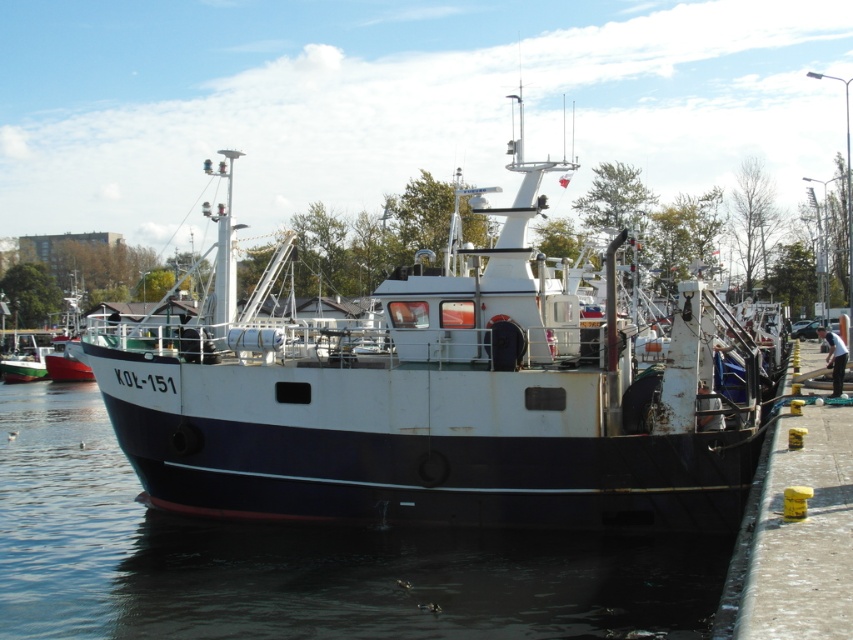
Question: Is white matte boat at center smaller than blue matte water at center?

Choices:
 (A) yes
 (B) no

Answer: (B)

Question: Which of the following is the farthest from the observer?

Choices:
 (A) (25, 333)
 (B) (483, 397)

Answer: (A)

Question: Can you confirm if blue matte water at center is smaller than white matte boat at left?

Choices:
 (A) no
 (B) yes

Answer: (A)

Question: Which point is farther to the camera?

Choices:
 (A) white matte boat at left
 (B) blue matte water at center
 (C) white matte boat at center

Answer: (A)

Question: Among these points, which one is nearest to the camera?

Choices:
 (A) pyautogui.click(x=102, y=609)
 (B) pyautogui.click(x=413, y=326)
 (C) pyautogui.click(x=38, y=369)

Answer: (A)

Question: Is blue matte water at center below white matte boat at left?

Choices:
 (A) yes
 (B) no

Answer: (A)